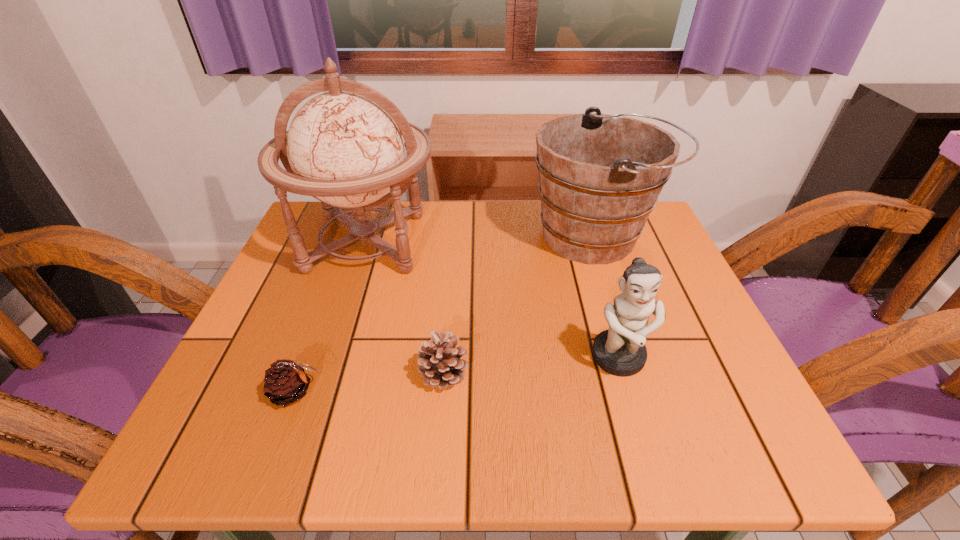
Find the location of a particular element. vacant region between the bucket and the right pinecone is located at coordinates (519, 305).

This screenshot has height=540, width=960. What are the coordinates of `vacant point located between the second shortest object and the left pinecone` in the screenshot? It's located at (370, 382).

Where is `empty location between the bucket and the second shortest object`? empty location between the bucket and the second shortest object is located at coordinates (519, 305).

You are a GUI agent. You are given a task and a screenshot of the screen. Output one action in this format:
    pyautogui.click(x=<x>, y=<y>)
    Task: Click on the free area in between the bucket and the right pinecone
    The image size is (960, 540).
    Given the screenshot: What is the action you would take?
    pyautogui.click(x=519, y=305)

Where is `free space between the bucket and the tallest object`? free space between the bucket and the tallest object is located at coordinates [x=481, y=240].

Where is `the second closest object to the shortest object`? the second closest object to the shortest object is located at coordinates (344, 147).

Identify which object is the closest to the third shortest object. Please provide its 2D coordinates. Your answer should be formatted as a tuple, i.e. [(x, y)], where the tuple contains the x and y coordinates of a point satisfying the conditions above.

[(600, 175)]

The width and height of the screenshot is (960, 540). Find the location of `free space that satisfies the following two spatial constraints: 1. on the front-facing side of the globe; 2. with a leaf charm attached to the left pinecone`. free space that satisfies the following two spatial constraints: 1. on the front-facing side of the globe; 2. with a leaf charm attached to the left pinecone is located at coordinates (317, 392).

I want to click on vacant space that satisfies the following two spatial constraints: 1. on the front-facing side of the tallest object; 2. on the right side of the fourth tallest object, so click(x=324, y=373).

This screenshot has width=960, height=540. What are the coordinates of `vacant space that satisfies the following two spatial constraints: 1. on the front-facing side of the globe; 2. on the right side of the fourth tallest object` in the screenshot? It's located at (324, 373).